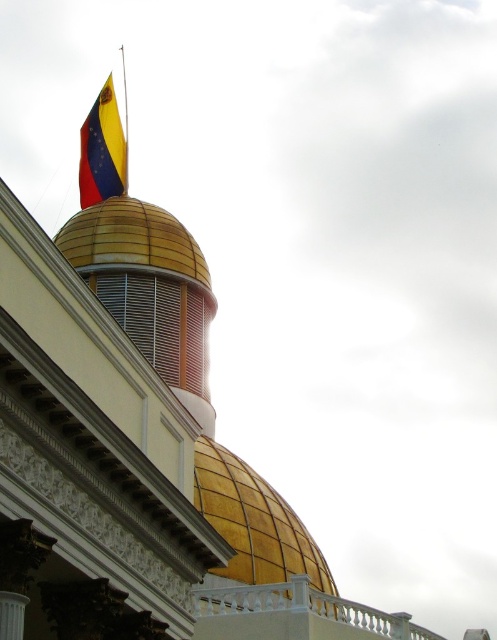
Can you confirm if gold metallic dome at upper center is smaller than yellow and red fabric flag at upper left?

Correct, gold metallic dome at upper center occupies less space than yellow and red fabric flag at upper left.

Looking at this image, does gold metallic dome at upper center appear on the right side of yellow and red fabric flag at upper left?

Indeed, gold metallic dome at upper center is positioned on the right side of yellow and red fabric flag at upper left.

Is point (243, 506) positioned after point (94, 168)?

That is False.

This screenshot has height=640, width=497. I want to click on gold metallic dome at upper center, so click(x=253, y=522).